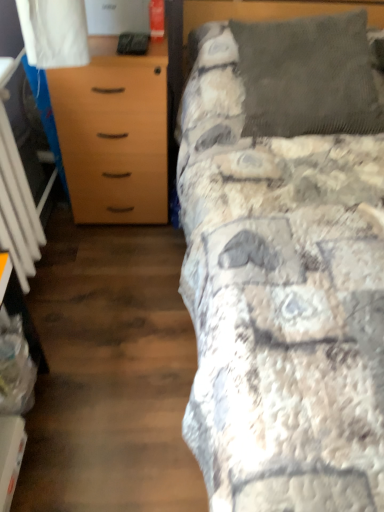
Locate an element on the screen. free location in front of light brown wood chest of drawers at left is located at coordinates (114, 262).